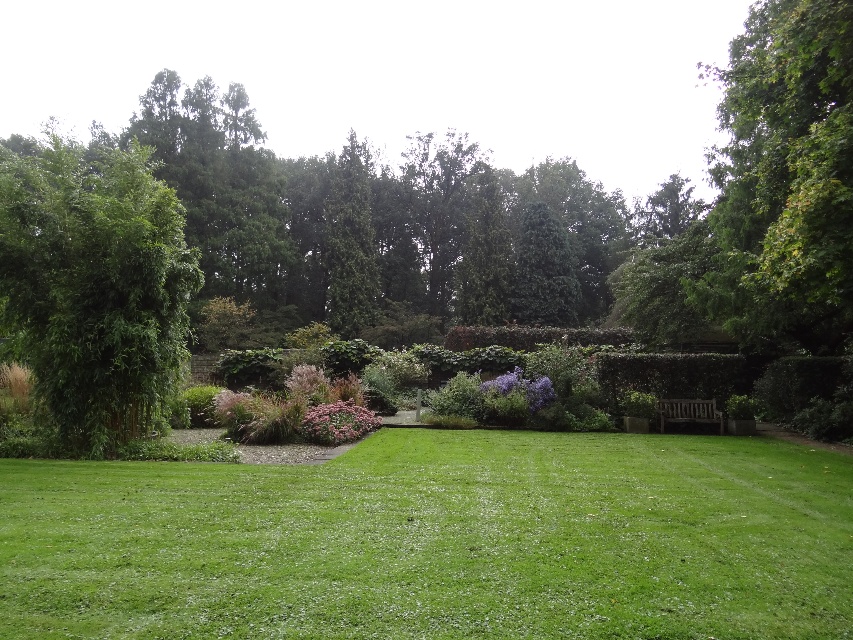
You are standing in the garden and want to take a photo of both the green leafy tree at left and the purple matte flower at center. Which object should you adjust your camera angle to look up at, and which to look down at?

You should look up at the green leafy tree at left and look down at the purple matte flower at center because the green leafy tree at left is above the purple matte flower at center.

You are a gardener who wants to plant a new tree between the green leafy tree at left and the gravel path. The new tree requires a minimum of 10 meters of space between it and the existing tree. Can you plant it there?

The distance between the green leafy tree at left and the gravel path is 12.13 meters. Since the new tree requires at least 10 meters of space, planting it there would be possible as the distance is sufficient.